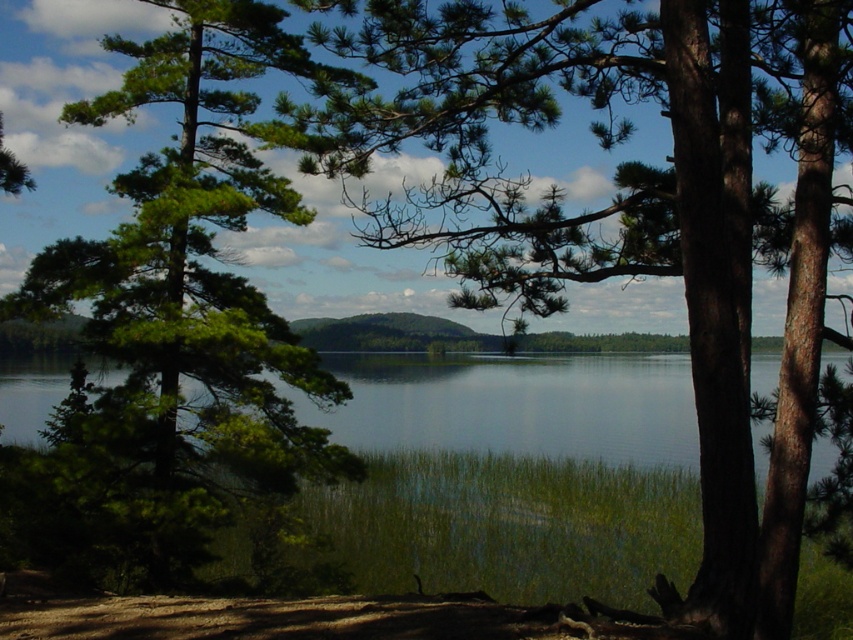
Question: Estimate the real-world distances between objects in this image. Which object is farther from the green needle-like leaves at center-left?

Choices:
 (A) green needle-like at left
 (B) green grassy water at lower center

Answer: (B)

Question: Is green needle-like leaves at center-left to the left of green grassy water at lower center from the viewer's perspective?

Choices:
 (A) no
 (B) yes

Answer: (A)

Question: Among these objects, which one is nearest to the camera?

Choices:
 (A) green grassy water at lower center
 (B) green needle-like at left
 (C) green needle-like leaves at center-left

Answer: (C)

Question: Which point is closer to the camera?

Choices:
 (A) green needle-like leaves at center-left
 (B) green needle-like at left
 (C) green grassy water at lower center

Answer: (A)

Question: Observing the image, what is the correct spatial positioning of green needle-like leaves at center-left in reference to green grassy water at lower center?

Choices:
 (A) left
 (B) right

Answer: (B)

Question: In this image, where is green needle-like leaves at center-left located relative to green grassy water at lower center?

Choices:
 (A) left
 (B) right

Answer: (B)